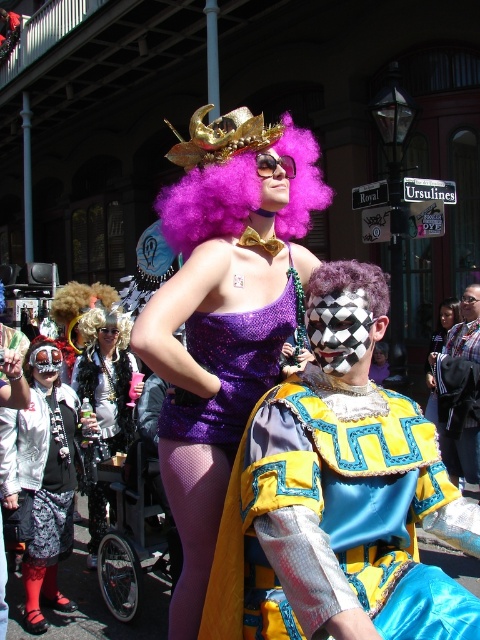
Who is more forward, (99, 285) or (436, 346)?

Point (99, 285)

Is curly blonde wig at upper left smaller than matte black wig at upper center?

No.

Does point (68, 305) come in front of point (434, 408)?

No, (68, 305) is further to viewer.

The width and height of the screenshot is (480, 640). Find the location of `curly blonde wig at upper left`. curly blonde wig at upper left is located at coordinates (80, 300).

Who is positioned more to the right, blue denim jacket at center or black matte wig at center?

From the viewer's perspective, black matte wig at center appears more on the right side.

Is point (466, 332) positioned in front of point (458, 304)?

Yes, point (466, 332) is closer to viewer.

Where is `blue denim jacket at center`? Image resolution: width=480 pixels, height=640 pixels. blue denim jacket at center is located at coordinates (459, 392).

Identify the location of blue denim jacket at center. (459, 392).

Is curly blonde wig at upper left to the right of shiny blonde wig at center from the viewer's perspective?

Incorrect, curly blonde wig at upper left is not on the right side of shiny blonde wig at center.

Which of these two, curly blonde wig at upper left or shiny blonde wig at center, stands shorter?

shiny blonde wig at center

Locate an element on the screen. The image size is (480, 640). curly blonde wig at upper left is located at coordinates (80, 300).